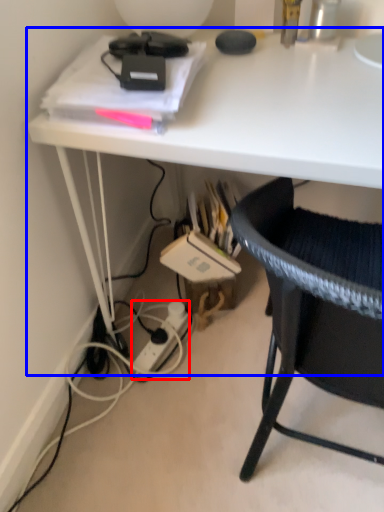
Question: Which object appears closest to the camera in this image, power outlet (highlighted by a red box) or desk (highlighted by a blue box)?

Choices:
 (A) power outlet
 (B) desk

Answer: (B)